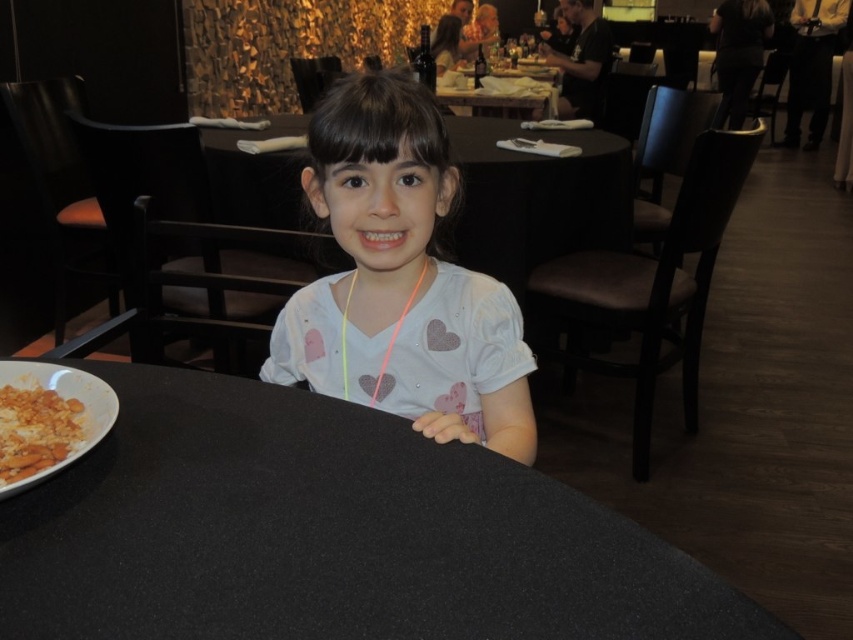
Question: Is white matte shirt at center above yellow crumbly food at lower left?

Choices:
 (A) no
 (B) yes

Answer: (B)

Question: Which point appears closest to the camera in this image?

Choices:
 (A) (210, 472)
 (B) (412, 86)

Answer: (A)

Question: Is black matte table at center above yellow crumbly food at lower left?

Choices:
 (A) yes
 (B) no

Answer: (B)

Question: Does white matte shirt at center appear under yellow crumbly food at lower left?

Choices:
 (A) yes
 (B) no

Answer: (B)

Question: Which point is closer to the camera taking this photo?

Choices:
 (A) (70, 426)
 (B) (351, 449)

Answer: (B)

Question: Estimate the real-world distances between objects in this image. Which object is farther from the white matte shirt at center?

Choices:
 (A) yellow crumbly food at lower left
 (B) black matte table at center

Answer: (A)